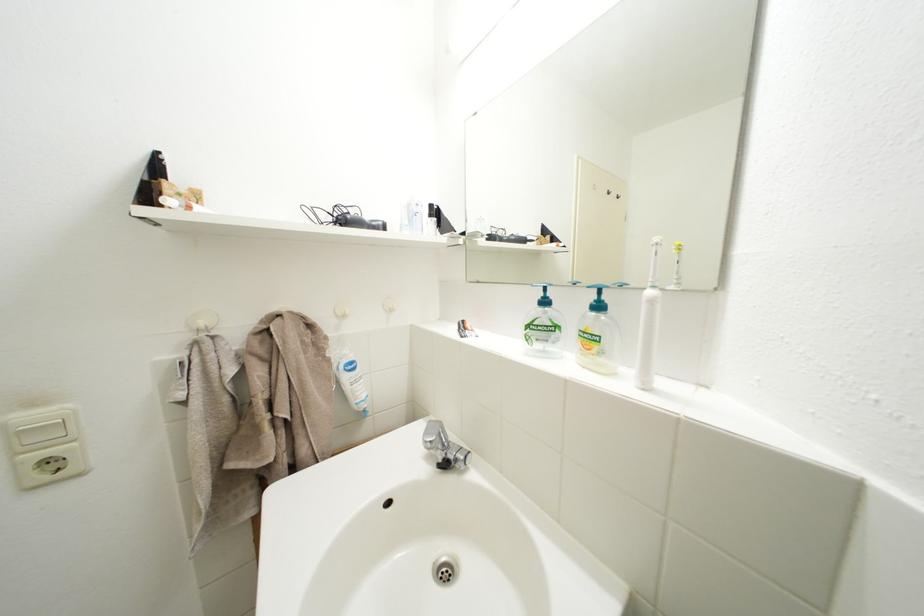
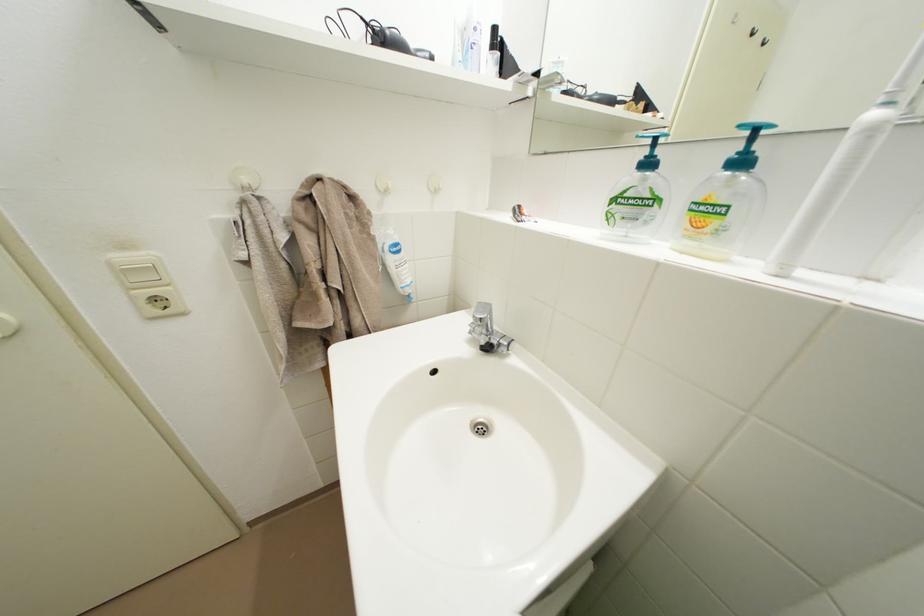
Which direction would the cameraman need to move to produce the second image?

The cameraman moved toward left, forward.